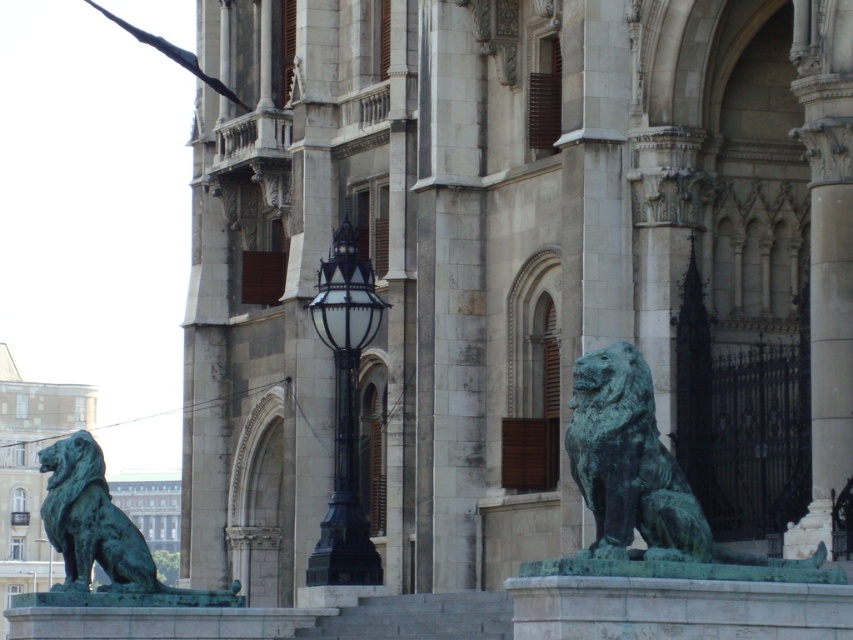
Is point (827, 52) closer to viewer compared to point (360, 582)?

Yes, it is in front of point (360, 582).

Between green patina stone lion at lower left and black glass lamp post at center, which one appears on the left side from the viewer's perspective?

From the viewer's perspective, black glass lamp post at center appears more on the left side.

Between point (476, 250) and point (372, 577), which one is positioned in front?

Point (372, 577) is in front.

Locate an element on the screen. The height and width of the screenshot is (640, 853). green patina stone lion at lower left is located at coordinates tap(492, 253).

Who is shorter, green patina stone lion at lower left or green patina stone lion at right?

With less height is green patina stone lion at right.

Can you confirm if green patina stone lion at lower left is shorter than green patina stone lion at right?

In fact, green patina stone lion at lower left may be taller than green patina stone lion at right.

Describe the element at coordinates (492, 253) in the screenshot. The width and height of the screenshot is (853, 640). I see `green patina stone lion at lower left` at that location.

The image size is (853, 640). What are the coordinates of `green patina stone lion at lower left` in the screenshot? It's located at (492, 253).

Measure the distance between point (352,308) and camera.

Point (352,308) and camera are 250.50 feet apart from each other.

Between point (341, 474) and point (86, 492), which one is positioned behind?

Point (341, 474)

Find the location of a particular element. The image size is (853, 640). black glass lamp post at center is located at coordinates (x=345, y=410).